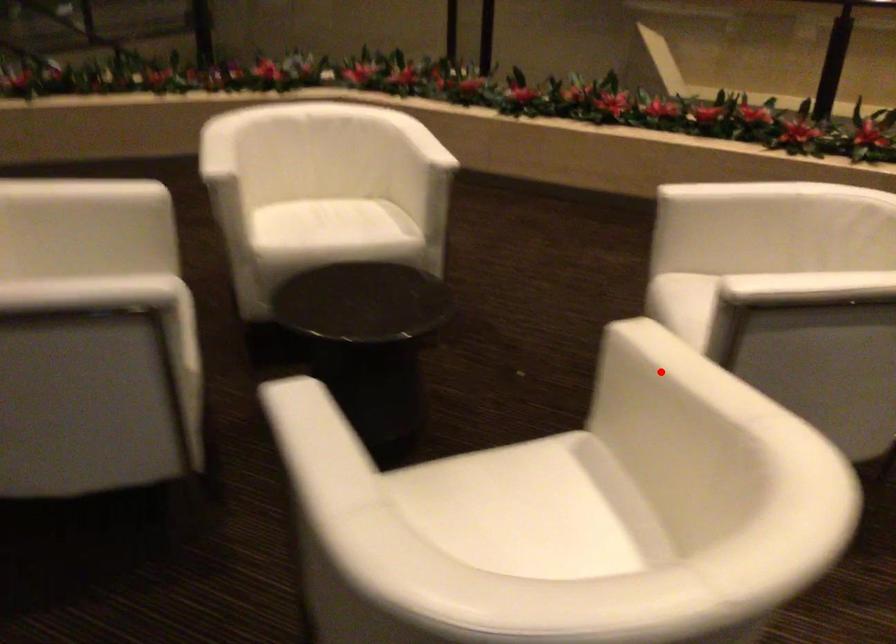
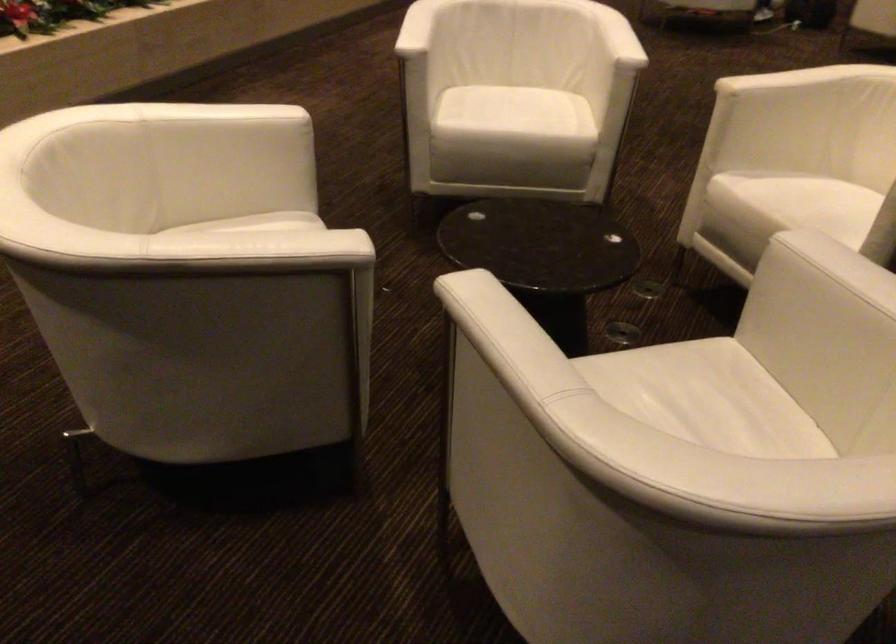
Where in the second image is the point corresponding to the highlighted location from the first image?

(789, 80)